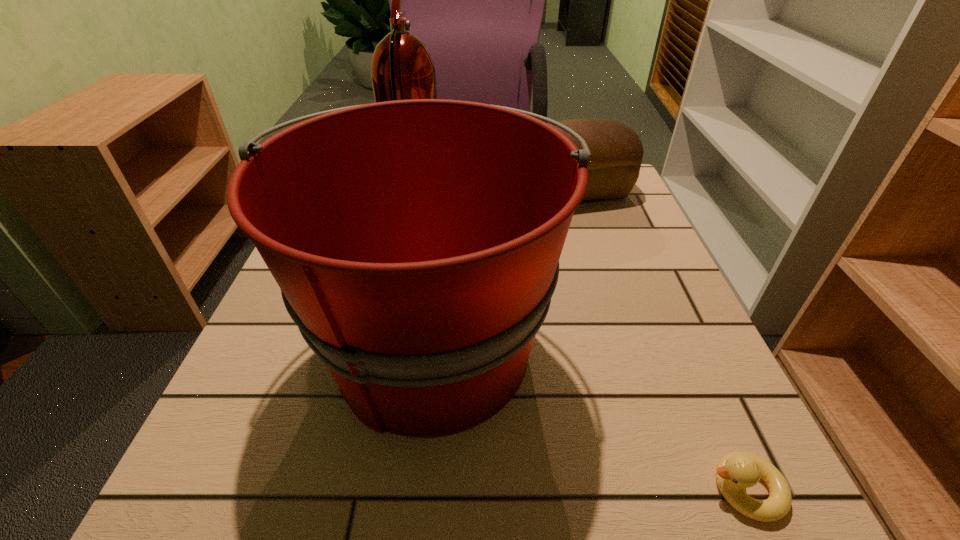
Locate an element on the screen. The width and height of the screenshot is (960, 540). fire extinguisher is located at coordinates (402, 68).

In order to click on bucket in this screenshot , I will do `click(416, 243)`.

Locate an element on the screen. This screenshot has width=960, height=540. bread is located at coordinates (616, 150).

Find the location of a particular element. This screenshot has width=960, height=540. duckling is located at coordinates (736, 471).

The width and height of the screenshot is (960, 540). Identify the location of free space located on the front-facing side of the tallest object. pyautogui.click(x=588, y=197).

Identify the location of vacant space located 0.050m on the back of the bucket. (444, 251).

Where is `free spot located 0.060m on the front of the third tallest object`? The width and height of the screenshot is (960, 540). free spot located 0.060m on the front of the third tallest object is located at coordinates (583, 228).

You are a GUI agent. You are given a task and a screenshot of the screen. Output one action in this format:
    pyautogui.click(x=<x>, y=<y>)
    Task: Click on the vacant space located 0.160m at the beak of the shortest object
    
    Given the screenshot: What is the action you would take?
    pyautogui.click(x=577, y=489)

Image resolution: width=960 pixels, height=540 pixels. Identify the location of vacant point located at the beak of the shortest object. (384, 489).

Where is `free region located at the beak of the shortest object`? The height and width of the screenshot is (540, 960). free region located at the beak of the shortest object is located at coordinates (569, 489).